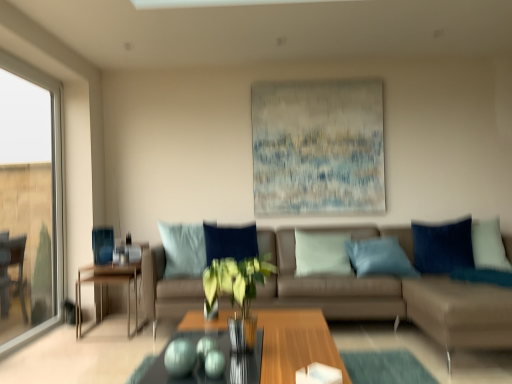
Identify the location of vacant area on top of textured canvas painting at upper center (from a real-world perspective). (312, 82).